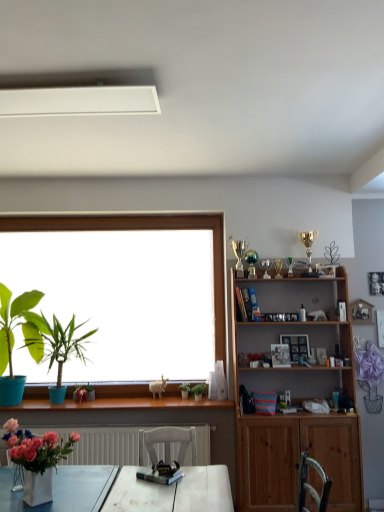
The height and width of the screenshot is (512, 384). Describe the element at coordinates (185, 390) in the screenshot. I see `green matte houseplant at center, the second houseplant in the right-to-left sequence` at that location.

The height and width of the screenshot is (512, 384). Describe the element at coordinates (63, 350) in the screenshot. I see `matte blue pot at left, the 2th houseplant when ordered from left to right` at that location.

Where is `green matte plant at center, arranged as the 4th houseplant when viewed from the left`? The width and height of the screenshot is (384, 512). green matte plant at center, arranged as the 4th houseplant when viewed from the left is located at coordinates (198, 391).

You are a GUI agent. You are given a task and a screenshot of the screen. Output one action in this format:
    pyautogui.click(x=<x>, y=<y>)
    Task: Click on the wooden shelf at right
    
    Given the screenshot: What is the action you would take?
    pyautogui.click(x=295, y=402)

Describe the element at coordinates (14, 339) in the screenshot. I see `matte green plant at left, the first houseplant from the left` at that location.

You are a GUI agent. You are given a task and a screenshot of the screen. Output one action in this format:
    pyautogui.click(x=<x>, y=<y>)
    Task: Click on the matte green plant at left, the first houseplant from the left
    Image resolution: width=384 pixels, height=512 pixels.
    Given the screenshot: What is the action you would take?
    tap(14, 339)

This screenshot has width=384, height=512. Describe the element at coordinates (79, 101) in the screenshot. I see `white matte exhaust hood at upper center` at that location.

This screenshot has height=512, width=384. I want to click on green matte houseplant at center, the second houseplant in the right-to-left sequence, so click(185, 390).

Is wooden picture frame at upper right, which appears as the 1th picture frame when viewed from the back, in contact with matte blue pot at left, which is the third houseplant in right-to-left order?

No, wooden picture frame at upper right, which appears as the 1th picture frame when viewed from the back, is not next to matte blue pot at left, which is the third houseplant in right-to-left order.

Looking at this image, which of these two, wooden picture frame at upper right, marked as the 2th picture frame in a left-to-right arrangement, or matte blue pot at left, which is the third houseplant in right-to-left order, stands taller?

Standing taller between the two is matte blue pot at left, which is the third houseplant in right-to-left order.

Is wooden picture frame at upper right, which is the 2th picture frame from front to back, wider or thinner than matte blue pot at left, which is the third houseplant in right-to-left order?

Clearly, wooden picture frame at upper right, which is the 2th picture frame from front to back, has less width compared to matte blue pot at left, which is the third houseplant in right-to-left order.

Does matte green plant at left, which is counted as the fourth houseplant, starting from the right, contain green matte plant at center, marked as the first houseplant in a right-to-left arrangement?

No, matte green plant at left, which is counted as the fourth houseplant, starting from the right, does not contain green matte plant at center, marked as the first houseplant in a right-to-left arrangement.

Is matte green plant at left, which is counted as the fourth houseplant, starting from the right, closer to the viewer compared to green matte plant at center, arranged as the 4th houseplant when viewed from the left?

Yes, matte green plant at left, which is counted as the fourth houseplant, starting from the right, is in front of green matte plant at center, arranged as the 4th houseplant when viewed from the left.

Looking at this image, is matte green plant at left, the first houseplant from the left, turned away from green matte plant at center, arranged as the 4th houseplant when viewed from the left?

That's not correct — matte green plant at left, the first houseplant from the left, is not looking away from green matte plant at center, arranged as the 4th houseplant when viewed from the left.

From a real-world perspective, is matte green plant at left, which is counted as the fourth houseplant, starting from the right, positioned above or below green matte plant at center, marked as the first houseplant in a right-to-left arrangement?

Clearly, from a real-world perspective, matte green plant at left, which is counted as the fourth houseplant, starting from the right, is above green matte plant at center, marked as the first houseplant in a right-to-left arrangement.

In the image, there is a matte blue pot at left, which is the third houseplant in right-to-left order. Where is `exhaust hood above it (from the image's perspective)`? This screenshot has width=384, height=512. exhaust hood above it (from the image's perspective) is located at coordinates (79, 101).

Is matte blue pot at left, the 2th houseplant when ordered from left to right, not within white matte exhaust hood at upper center?

Yes, matte blue pot at left, the 2th houseplant when ordered from left to right, is outside of white matte exhaust hood at upper center.

Between matte blue pot at left, which is the third houseplant in right-to-left order, and white matte exhaust hood at upper center, which one has less height?

white matte exhaust hood at upper center.

Is wooden shelf at right inside the boundaries of green matte plant at center, arranged as the 4th houseplant when viewed from the left, or outside?

wooden shelf at right cannot be found inside green matte plant at center, arranged as the 4th houseplant when viewed from the left.

Visually, is wooden shelf at right positioned to the left or to the right of green matte plant at center, marked as the first houseplant in a right-to-left arrangement?

From the image, it's evident that wooden shelf at right is to the right of green matte plant at center, marked as the first houseplant in a right-to-left arrangement.

Which of these two, wooden shelf at right or green matte plant at center, arranged as the 4th houseplant when viewed from the left, is smaller?

green matte plant at center, arranged as the 4th houseplant when viewed from the left.

Considering the relative sizes of wooden shelf at right and green matte plant at center, arranged as the 4th houseplant when viewed from the left, in the image provided, is wooden shelf at right shorter than green matte plant at center, arranged as the 4th houseplant when viewed from the left,?

In fact, wooden shelf at right may be taller than green matte plant at center, arranged as the 4th houseplant when viewed from the left.

How distant is white matte exhaust hood at upper center from green matte plant at center, arranged as the 4th houseplant when viewed from the left?

A distance of 2.51 meters exists between white matte exhaust hood at upper center and green matte plant at center, arranged as the 4th houseplant when viewed from the left.

Does white matte exhaust hood at upper center turn towards green matte plant at center, arranged as the 4th houseplant when viewed from the left?

No.

How different are the orientations of white matte exhaust hood at upper center and green matte plant at center, marked as the first houseplant in a right-to-left arrangement, in degrees?

3.5 degrees separate the facing orientations of white matte exhaust hood at upper center and green matte plant at center, marked as the first houseplant in a right-to-left arrangement.

From a real-world perspective, is white matte exhaust hood at upper center below green matte plant at center, marked as the first houseplant in a right-to-left arrangement?

No.

Is green matte plant at center, marked as the first houseplant in a right-to-left arrangement, beside matte green plant at left, the first houseplant from the left?

green matte plant at center, marked as the first houseplant in a right-to-left arrangement, is not next to matte green plant at left, the first houseplant from the left, and they're not touching.

Relative to matte green plant at left, which is counted as the fourth houseplant, starting from the right, is green matte plant at center, marked as the first houseplant in a right-to-left arrangement, in front or behind?

Visually, green matte plant at center, marked as the first houseplant in a right-to-left arrangement, is located behind matte green plant at left, which is counted as the fourth houseplant, starting from the right.

Consider the image. Is green matte plant at center, marked as the first houseplant in a right-to-left arrangement, turned away from matte green plant at left, the first houseplant from the left?

No, green matte plant at center, marked as the first houseplant in a right-to-left arrangement,'s orientation is not away from matte green plant at left, the first houseplant from the left.

From the picture: Between green matte plant at center, arranged as the 4th houseplant when viewed from the left, and matte green plant at left, which is counted as the fourth houseplant, starting from the right, which one has more height?

Standing taller between the two is matte green plant at left, which is counted as the fourth houseplant, starting from the right.

Considering the sizes of green matte plant at center, marked as the first houseplant in a right-to-left arrangement, and white matte exhaust hood at upper center in the image, is green matte plant at center, marked as the first houseplant in a right-to-left arrangement, taller or shorter than white matte exhaust hood at upper center?

green matte plant at center, marked as the first houseplant in a right-to-left arrangement, is taller than white matte exhaust hood at upper center.

Could you measure the distance between green matte plant at center, marked as the first houseplant in a right-to-left arrangement, and white matte exhaust hood at upper center?

The distance of green matte plant at center, marked as the first houseplant in a right-to-left arrangement, from white matte exhaust hood at upper center is 8.24 feet.

Could you tell me if green matte plant at center, arranged as the 4th houseplant when viewed from the left, is turned towards white matte exhaust hood at upper center?

No, green matte plant at center, arranged as the 4th houseplant when viewed from the left, does not turn towards white matte exhaust hood at upper center.

The height and width of the screenshot is (512, 384). I want to click on exhaust hood that appears above the green matte plant at center, marked as the first houseplant in a right-to-left arrangement (from a real-world perspective), so click(x=79, y=101).

The height and width of the screenshot is (512, 384). In order to click on houseplant that is the 1st object located above the wooden picture frame at upper right, marked as the 2th picture frame in a left-to-right arrangement (from the image's perspective) in this screenshot , I will do `click(63, 350)`.

What are the coordinates of `houseplant that is the 2nd object located below the matte green plant at left, the first houseplant from the left (from the image's perspective)` in the screenshot? It's located at 198,391.

When comparing their distances from white matte exhaust hood at upper center, does wooden picture frame at upper right, which is the 1th picture frame from left to right, or matte blue pot at left, which is the third houseplant in right-to-left order, seem closer?

matte blue pot at left, which is the third houseplant in right-to-left order, is closer to white matte exhaust hood at upper center.

From the image, which object appears to be nearer to white matte exhaust hood at upper center, matte green plant at left, the first houseplant from the left, or wooden picture frame at upper right, arranged as the second picture frame when viewed from the back?

Among the two, matte green plant at left, the first houseplant from the left, is located nearer to white matte exhaust hood at upper center.

From the image, which object appears to be farther from wooden picture frame at upper right, which appears as the 1th picture frame when viewed from the back, matte green plant at left, the first houseplant from the left, or wooden picture frame at upper right, the 2th picture frame when ordered from right to left?

matte green plant at left, the first houseplant from the left.

In the scene shown: Considering their positions, is wooden shelf at right positioned closer to green matte plant at center, marked as the first houseplant in a right-to-left arrangement, than wooden picture frame at upper right, which appears as the 1th picture frame when viewed from the back?

The object closer to green matte plant at center, marked as the first houseplant in a right-to-left arrangement, is wooden picture frame at upper right, which appears as the 1th picture frame when viewed from the back.

Which object lies further to the anchor point wooden picture frame at upper right, marked as the 2th picture frame in a left-to-right arrangement, wooden shelf at right or matte green plant at left, the first houseplant from the left?

matte green plant at left, the first houseplant from the left.

Estimate the real-world distances between objects in this image. Which object is further from white matte exhaust hood at upper center, matte blue pot at left, the 2th houseplant when ordered from left to right, or wooden shelf at right?

wooden shelf at right is further to white matte exhaust hood at upper center.

From the picture: When comparing their distances from wooden picture frame at upper right, marked as the 2th picture frame in a left-to-right arrangement, does green matte houseplant at center, the second houseplant in the right-to-left sequence, or white matte exhaust hood at upper center seem further?

white matte exhaust hood at upper center lies further to wooden picture frame at upper right, marked as the 2th picture frame in a left-to-right arrangement, than the other object.

When comparing their distances from green matte houseplant at center, the second houseplant in the right-to-left sequence, does matte green plant at left, the first houseplant from the left, or wooden shelf at right seem further?

Based on the image, matte green plant at left, the first houseplant from the left, appears to be further to green matte houseplant at center, the second houseplant in the right-to-left sequence.

Find the location of a particular element. This screenshot has height=512, width=384. picture frame situated between green matte houseplant at center, the second houseplant in the right-to-left sequence, and wooden shelf at right from left to right is located at coordinates (280, 355).

Locate an element on the screen. picture frame between matte blue pot at left, which is the third houseplant in right-to-left order, and wooden shelf at right, in the horizontal direction is located at coordinates (280, 355).

This screenshot has height=512, width=384. Find the location of `shelf situated between matte blue pot at left, the 2th houseplant when ordered from left to right, and wooden picture frame at upper right, positioned as the 1th picture frame in right-to-left order, from left to right`. shelf situated between matte blue pot at left, the 2th houseplant when ordered from left to right, and wooden picture frame at upper right, positioned as the 1th picture frame in right-to-left order, from left to right is located at coordinates (295, 402).

You are a GUI agent. You are given a task and a screenshot of the screen. Output one action in this format:
    pyautogui.click(x=<x>, y=<y>)
    Task: Click on the houseplant between green matte houseplant at center, marked as the 3th houseplant in a left-to-right arrangement, and wooden picture frame at upper right, which appears as the 1th picture frame when viewed from the back, in the horizontal direction
    Image resolution: width=384 pixels, height=512 pixels.
    Given the screenshot: What is the action you would take?
    pyautogui.click(x=198, y=391)